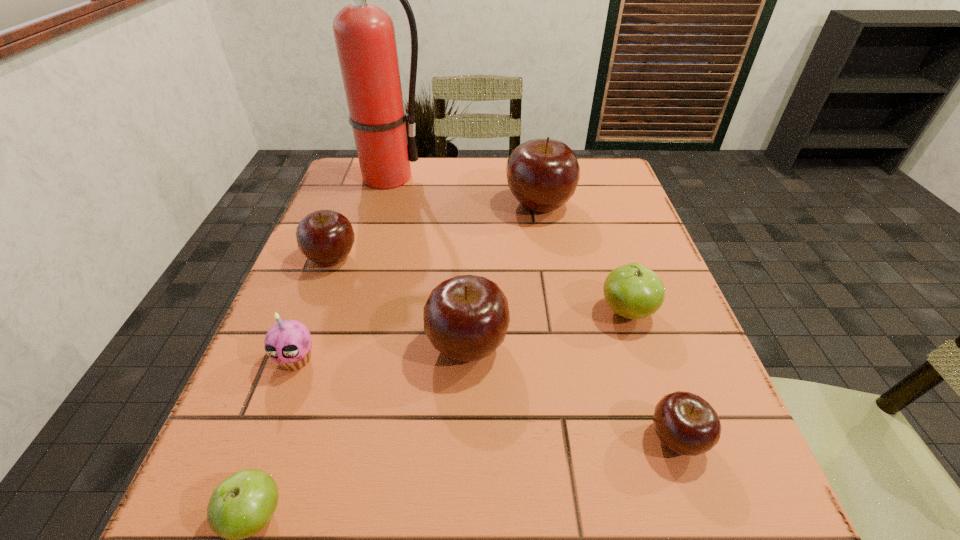
Where is `unoccupied position between the farthest apple and the seventh farthest object`? The height and width of the screenshot is (540, 960). unoccupied position between the farthest apple and the seventh farthest object is located at coordinates (608, 321).

This screenshot has width=960, height=540. Find the location of `free spot between the tallest apple and the cupcake`. free spot between the tallest apple and the cupcake is located at coordinates (418, 282).

Identify the location of empty space that is in between the farthest red apple and the cupcake. (418, 282).

Locate which object is the seventh closest to the fourth object from right to left. Please provide its 2D coordinates. Your answer should be formatted as a tuple, i.e. [(x, y)], where the tuple contains the x and y coordinates of a point satisfying the conditions above.

[(364, 33)]

Where is `the seventh closest object to the second nearest apple`? the seventh closest object to the second nearest apple is located at coordinates (364, 33).

Locate which apple is the second closest to the cupcake. Please provide its 2D coordinates. Your answer should be formatted as a tuple, i.e. [(x, y)], where the tuple contains the x and y coordinates of a point satisfying the conditions above.

[(240, 506)]

Locate an element on the screen. Image resolution: width=960 pixels, height=540 pixels. the fifth closest apple to the biggest red apple is located at coordinates (240, 506).

The width and height of the screenshot is (960, 540). What are the coordinates of `red apple object that ranks as the closest to the second tallest object` in the screenshot? It's located at (466, 317).

Identify the location of red apple that stands as the second closest to the cupcake. The height and width of the screenshot is (540, 960). (466, 317).

Locate an element on the screen. This screenshot has width=960, height=540. vacant area in the image that satisfies the following two spatial constraints: 1. on the face of the cupcake; 2. on the right side of the nearest red apple is located at coordinates (267, 438).